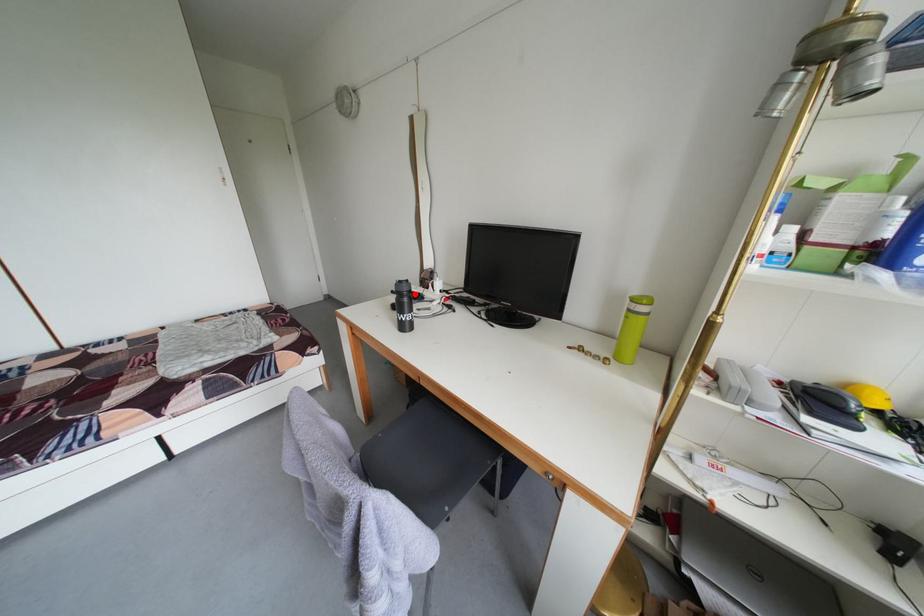
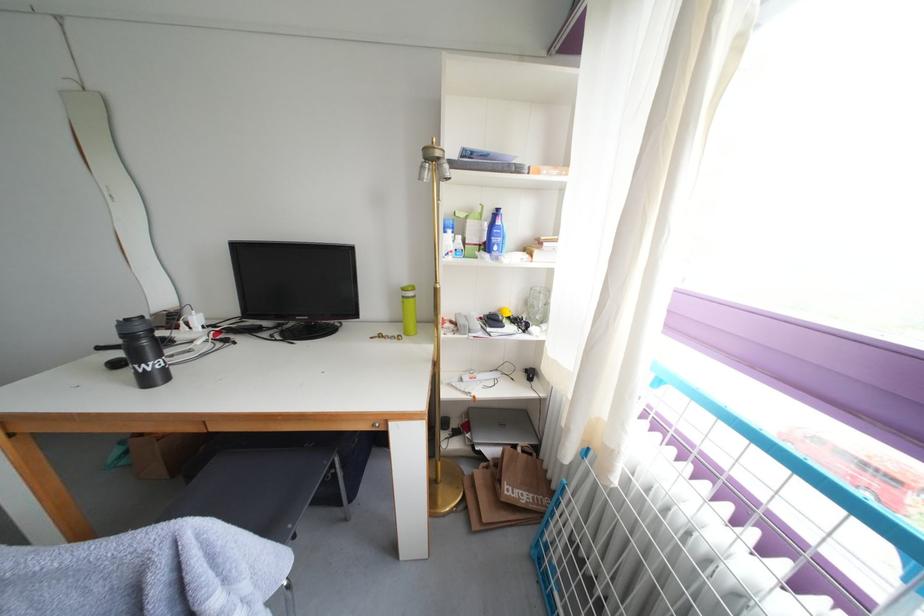
In the second image, find the point that corresponds to the highlighted location in the first image.

(150, 334)